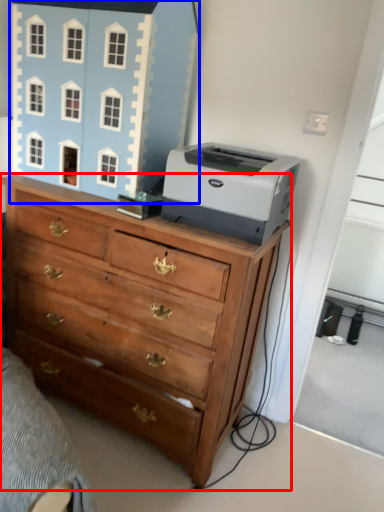
Question: Which of the following is the closest to the observer, chest of drawers (highlighted by a red box) or toy (highlighted by a blue box)?

Choices:
 (A) chest of drawers
 (B) toy

Answer: (A)